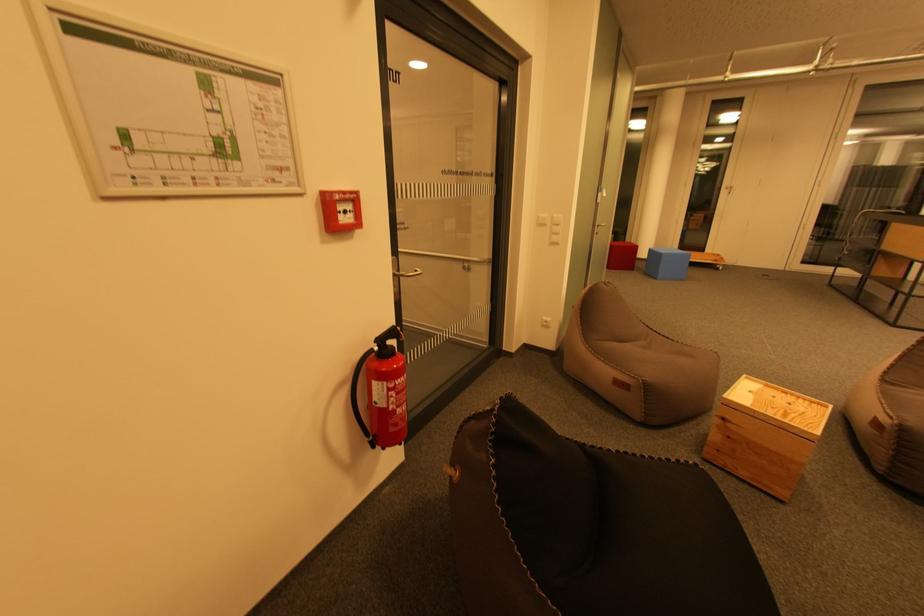
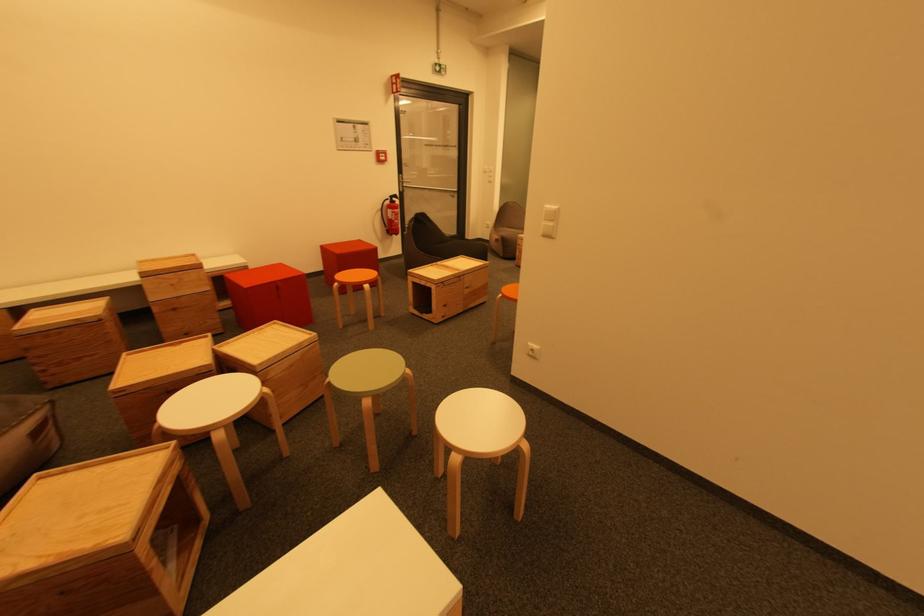
What movement of the cameraman would produce the second image?

The cameraman moved toward right, backward.